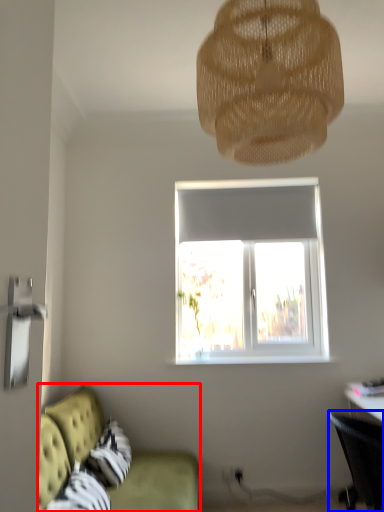
Question: Which object is further to the camera taking this photo, studio couch (highlighted by a red box) or chair (highlighted by a blue box)?

Choices:
 (A) studio couch
 (B) chair

Answer: (B)